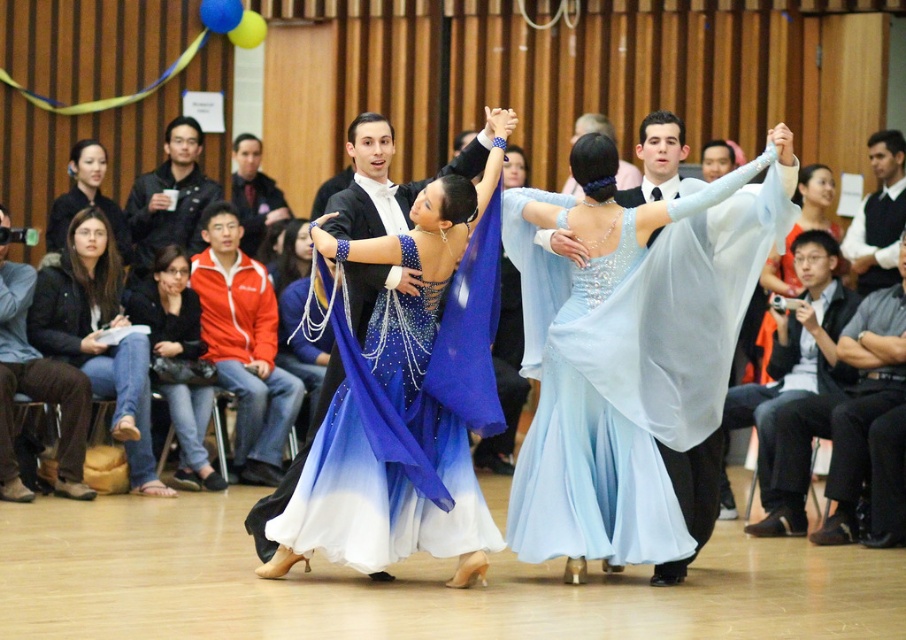
Question: Which object appears farthest from the camera in this image?

Choices:
 (A) black fabric camera at right
 (B) black sweater at upper right
 (C) blue satin dress at center

Answer: (B)

Question: Does black leather jacket at lower left have a greater width compared to black satin dress at upper left?

Choices:
 (A) yes
 (B) no

Answer: (A)

Question: Does light blue satin dress at center appear under brown leather boots at lower left?

Choices:
 (A) no
 (B) yes

Answer: (A)

Question: Can you confirm if blue satin dress at center is positioned below black satin dress at upper left?

Choices:
 (A) no
 (B) yes

Answer: (B)

Question: Which object is the farthest from the shiny blue dress at center?

Choices:
 (A) black satin dress at upper left
 (B) black leather jacket at lower left
 (C) black sweater at upper right

Answer: (C)

Question: Estimate the real-world distances between objects in this image. Which object is farther from the black satin tie at upper center?

Choices:
 (A) black sweater at upper right
 (B) black leather pants at lower right

Answer: (B)